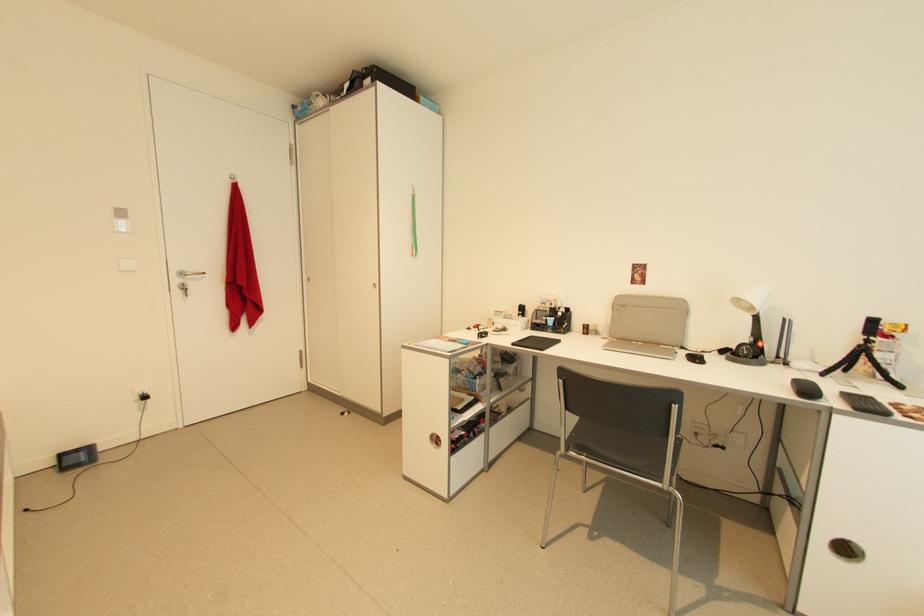
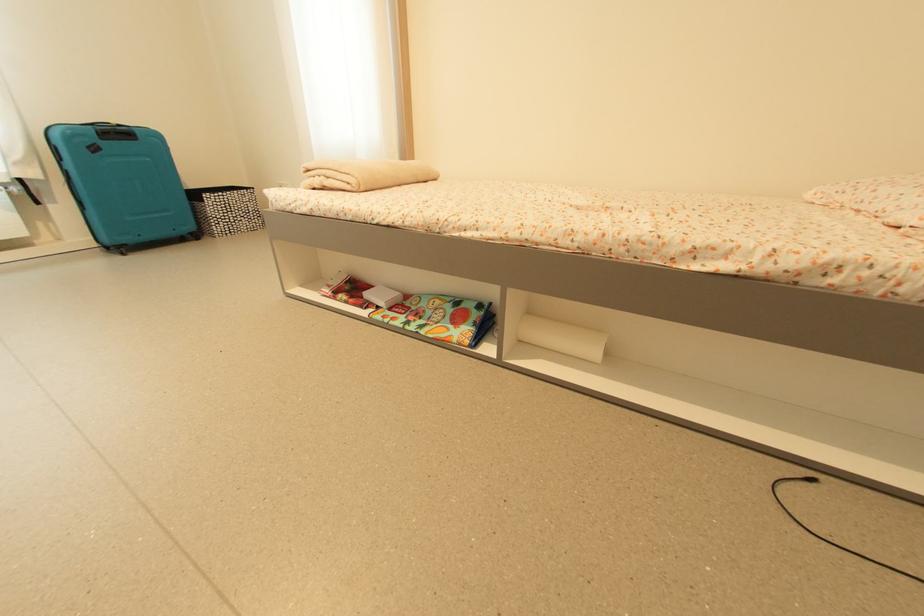
Locate, in the second image, the point that corresponds to [30,512] in the first image.

(817, 483)